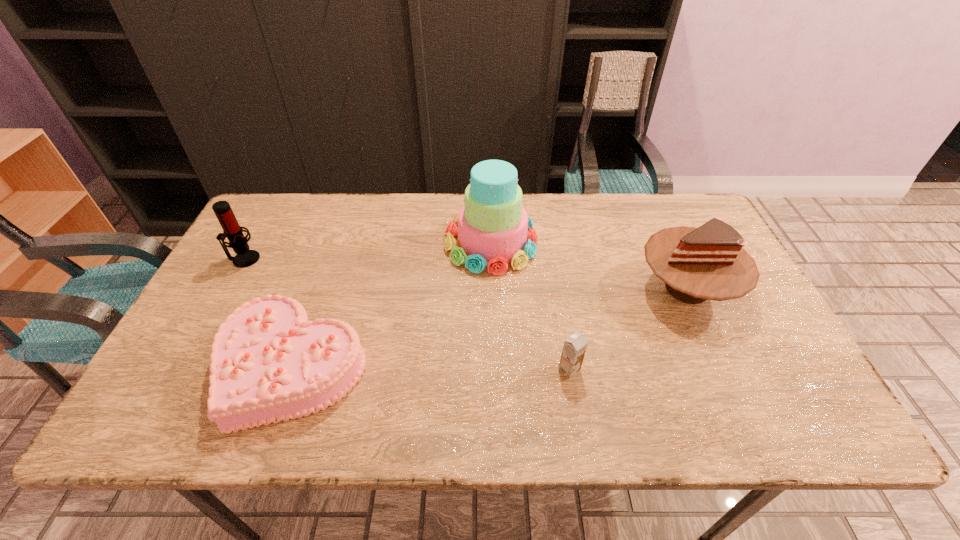
Identify the location of empty space between the rightmost object and the tallest object. This screenshot has height=540, width=960. (588, 265).

You are a GUI agent. You are given a task and a screenshot of the screen. Output one action in this format:
    pyautogui.click(x=<x>, y=<y>)
    Task: Click on the vacant point located between the second tallest cake and the second object from left to right
    
    Given the screenshot: What is the action you would take?
    pyautogui.click(x=490, y=328)

Identify the location of free space between the shortest object and the rightmost object. (490, 328).

Identify the location of object that stands as the second closest to the leftmost object. (492, 231).

Locate which object ranks fourth in proximity to the fourth tallest object. Please provide its 2D coordinates. Your answer should be formatted as a tuple, i.e. [(x, y)], where the tuple contains the x and y coordinates of a point satisfying the conditions above.

[(231, 229)]

This screenshot has height=540, width=960. In order to click on cake identified as the closest to the rightmost cake in this screenshot , I will do `click(492, 231)`.

Locate an element on the screen. The image size is (960, 540). the second closest cake to the rightmost cake is located at coordinates (269, 363).

The height and width of the screenshot is (540, 960). In order to click on vacant region that satisfies the following two spatial constraints: 1. on the front side of the microphone; 2. on the left side of the second shortest object in this screenshot , I will do `click(182, 369)`.

Locate an element on the screen. The width and height of the screenshot is (960, 540). vacant space that satisfies the following two spatial constraints: 1. on the front side of the leftmost cake; 2. on the right side of the leftmost object is located at coordinates (183, 367).

At what (x,y) coordinates should I click in order to perform the action: click on vacant space that satisfies the following two spatial constraints: 1. on the front side of the fourth object from left to right; 2. on the right side of the leftmost cake. Please return your answer as a coordinate pair (x, y). This screenshot has height=540, width=960. Looking at the image, I should click on (292, 369).